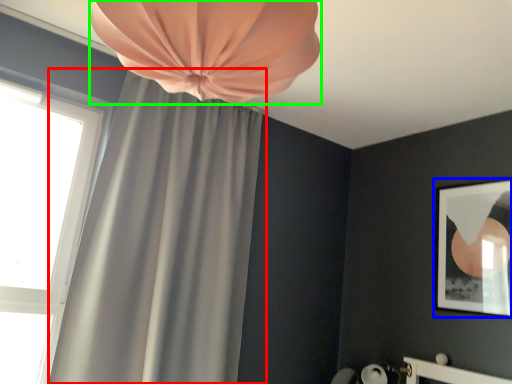
Question: Considering the real-world distances, which object is farthest from curtain (highlighted by a red box)? picture frame (highlighted by a blue box) or curtain (highlighted by a green box)?

Choices:
 (A) picture frame
 (B) curtain

Answer: (A)